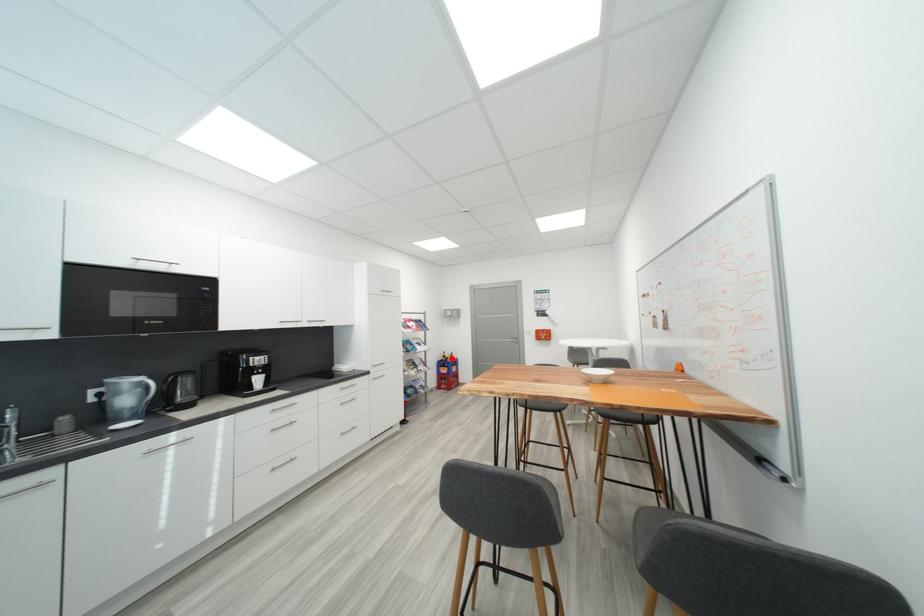
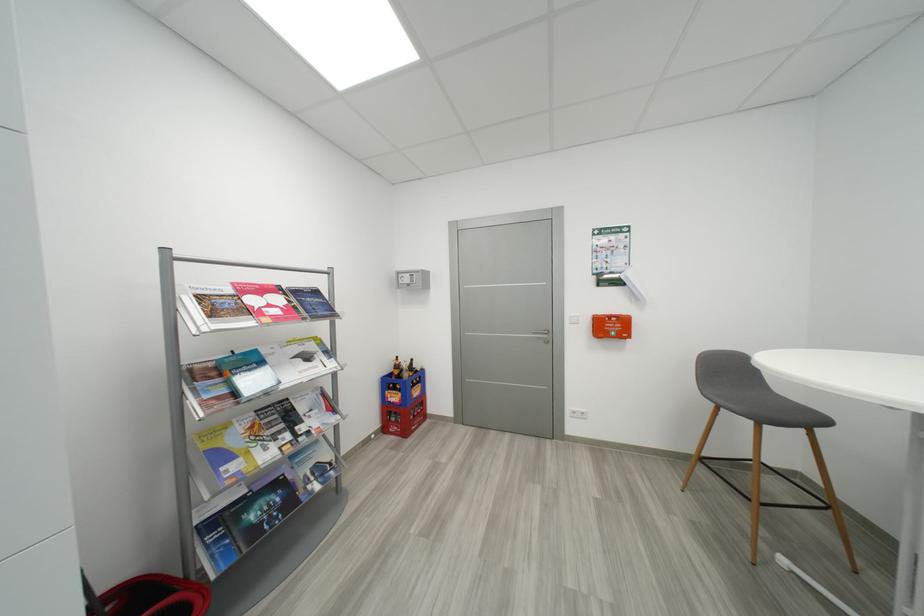
Question: A red point is marked in image1. In image2, is the corresponding 3D point closer to the camera or farther? Reply with the corresponding letter.

Choices:
 (A) The corresponding 3D point is closer.
 (B) The corresponding 3D point is farther.

Answer: (A)